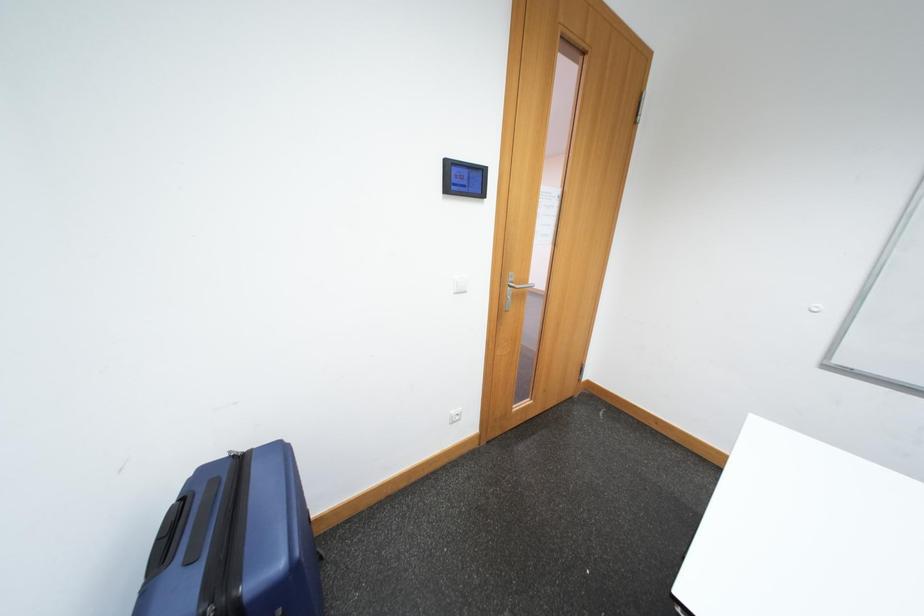
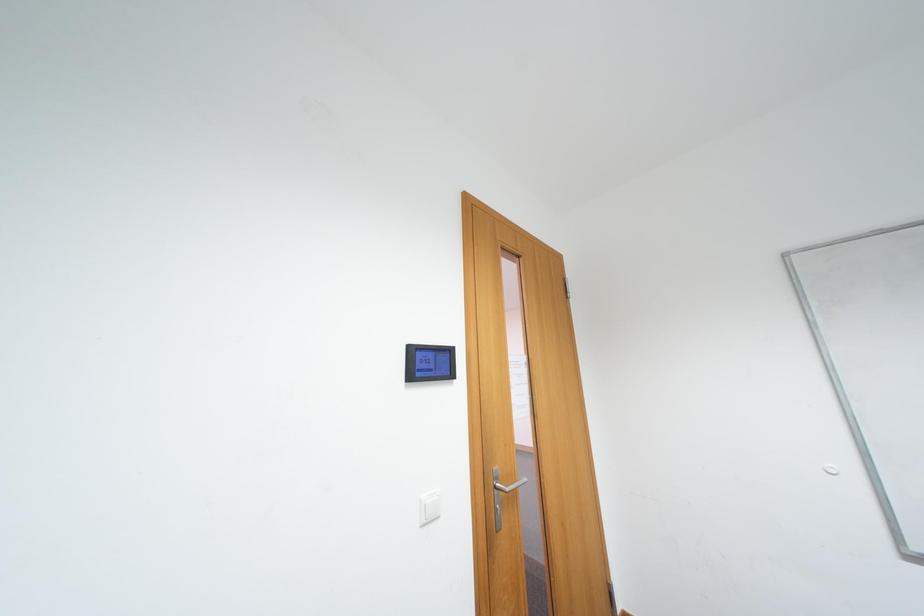
Question: Based on the continuous images, in which direction is the camera rotating? Reply with the corresponding letter.

Choices:
 (A) Left
 (B) Right
 (C) Up
 (D) Down

Answer: (C)